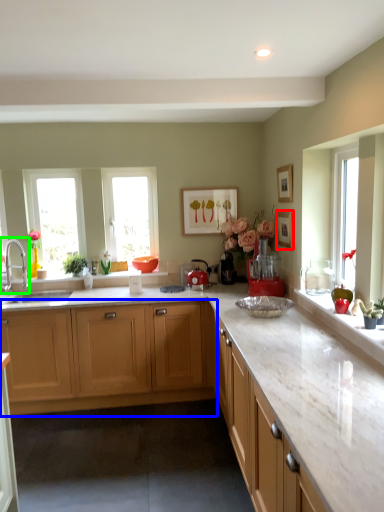
Question: Estimate the real-world distances between objects in this image. Which object is closer to picture frame (highlighted by a red box), cabinetry (highlighted by a blue box) or tap (highlighted by a green box)?

Choices:
 (A) cabinetry
 (B) tap

Answer: (A)